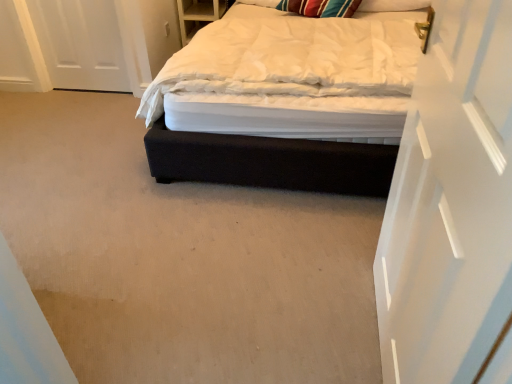
Question: In terms of size, does dark fabric bed at center appear bigger or smaller than white glossy door at upper right?

Choices:
 (A) big
 (B) small

Answer: (A)

Question: From their relative heights in the image, would you say dark fabric bed at center is taller or shorter than white glossy door at upper right?

Choices:
 (A) tall
 (B) short

Answer: (B)

Question: Estimate the real-world distances between objects in this image. Which object is farther from the white glossy door at upper right?

Choices:
 (A) striped fabric pillow at upper right
 (B) dark fabric bed at center

Answer: (A)

Question: Considering the real-world distances, which object is farthest from the dark fabric bed at center?

Choices:
 (A) striped fabric pillow at upper right
 (B) white glossy door at upper right

Answer: (A)